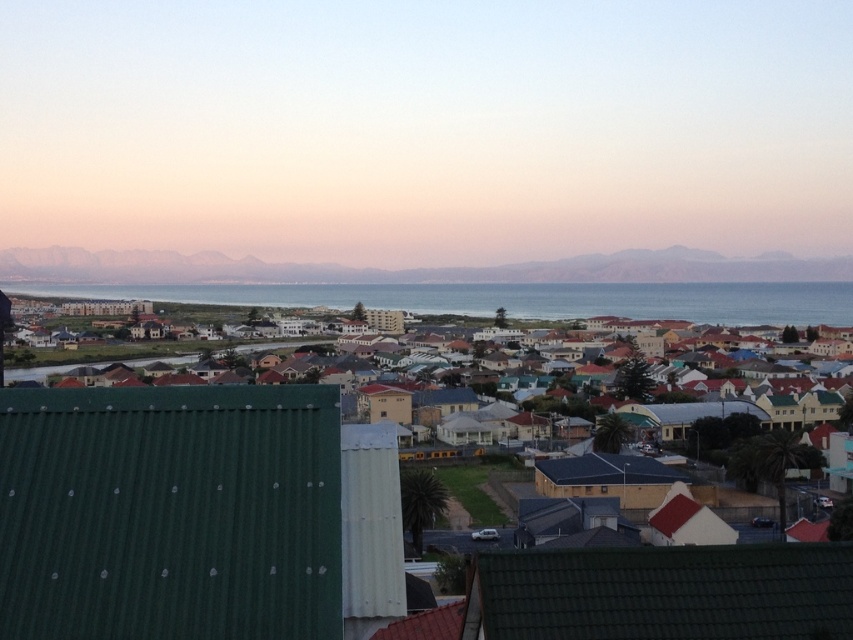
Is point (735, 593) behind point (761, 307)?

No, it is in front of (761, 307).

The width and height of the screenshot is (853, 640). In order to click on green corrugated metal town at center in this screenshot , I will do `click(190, 513)`.